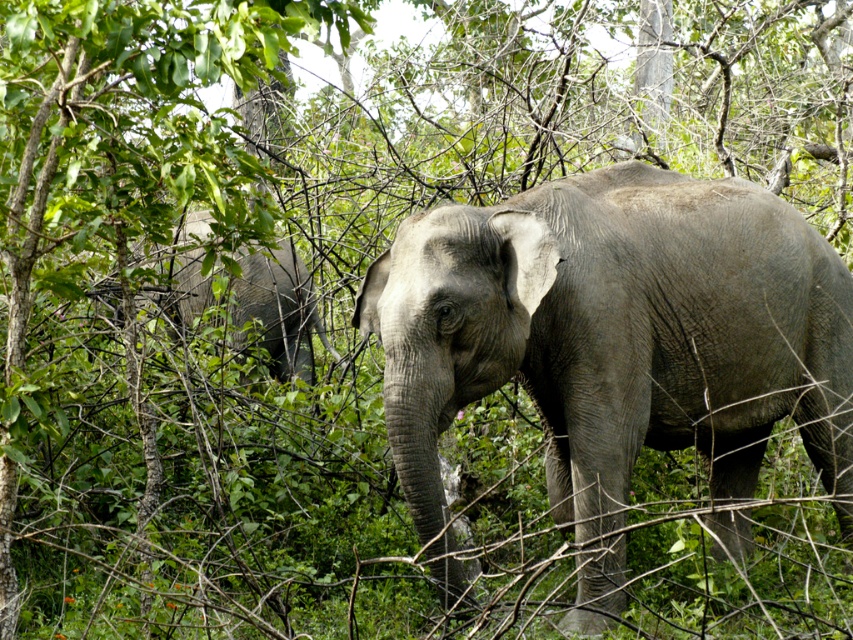
You are a wildlife photographer aiming to capture both elephants in the frame. Given that the gray matte elephant at center is wider than the gray matte elephant at left, which elephant should you focus on to ensure both fit in the photo without cropping?

Since the gray matte elephant at center is wider than the gray matte elephant at left, you should focus on positioning the camera so that the gray matte elephant at left is closer to the edges of the frame. This allows the wider gray matte elephant at center to occupy more central space while still including the narrower gray matte elephant at left within the frame.

You are standing in the natural scene with two elephants. You see two points marked in the image. The first point is at coordinate point(612, 200) and the second point is at coordinate point(253, 301). Which of these two points is closer to you?

Point(612, 200) is closer to the viewer than point(253, 301).

You are an ecologist observing two elephants in a dense forest. You see the gray matte elephant at center and the gray matte elephant at left. Which elephant is located higher up in the image?

The gray matte elephant at left is higher up because the gray matte elephant at center is positioned under it.